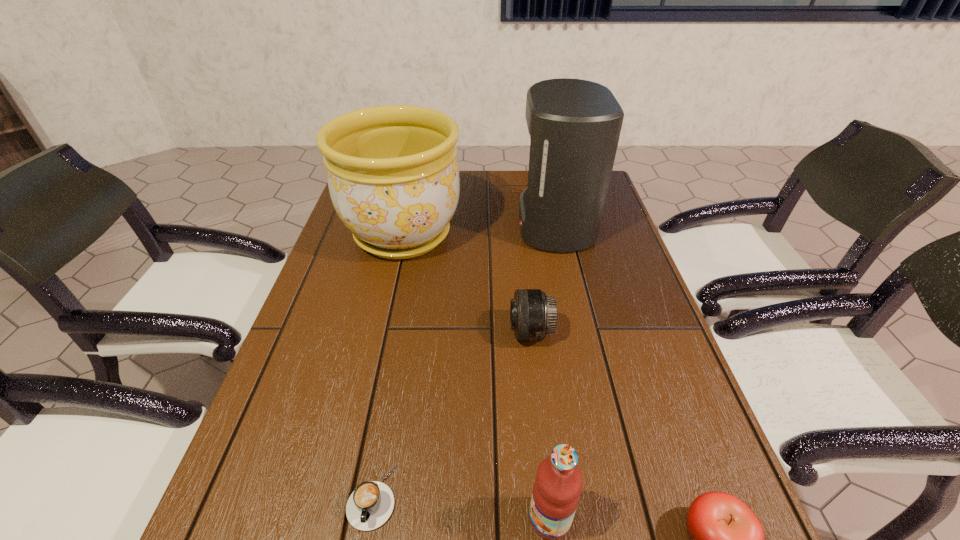
Identify the location of free space located 0.330m on the front-facing side of the third farthest object. (367, 332).

The height and width of the screenshot is (540, 960). I want to click on coffee maker positioned at the far edge, so click(x=574, y=125).

Where is `flowerpot that is positioned at the far edge`? This screenshot has height=540, width=960. flowerpot that is positioned at the far edge is located at coordinates (393, 176).

Where is `object positioned at the left edge`? Image resolution: width=960 pixels, height=540 pixels. object positioned at the left edge is located at coordinates (393, 176).

You are a GUI agent. You are given a task and a screenshot of the screen. Output one action in this format:
    pyautogui.click(x=<x>, y=<y>)
    Task: Click on the object located at the right edge
    The width and height of the screenshot is (960, 540).
    Given the screenshot: What is the action you would take?
    pyautogui.click(x=574, y=125)

The image size is (960, 540). I want to click on object that is positioned at the far left corner, so 393,176.

Where is `object that is positioned at the far right corner`? This screenshot has width=960, height=540. object that is positioned at the far right corner is located at coordinates (574, 125).

Image resolution: width=960 pixels, height=540 pixels. Identify the location of free space at the far edge of the desktop. click(x=464, y=171).

Where is `vacant space at the left edge of the desktop`? Image resolution: width=960 pixels, height=540 pixels. vacant space at the left edge of the desktop is located at coordinates (370, 299).

The height and width of the screenshot is (540, 960). In the image, there is a desktop. Find the location of `free space at the right edge`. free space at the right edge is located at coordinates (649, 433).